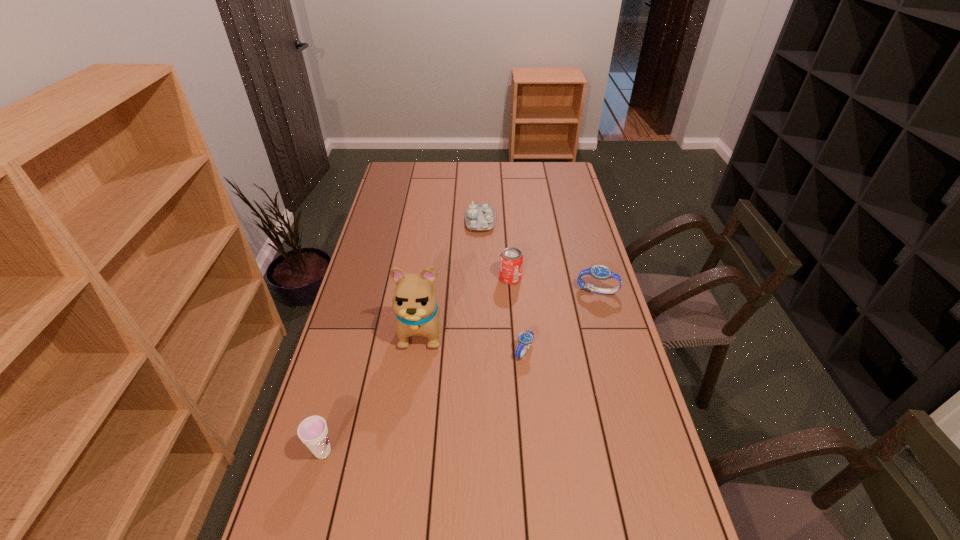
Locate an element on the screen. This screenshot has height=540, width=960. the nearer watch is located at coordinates (525, 339).

Find the location of a particular element. This screenshot has height=540, width=960. the left watch is located at coordinates (525, 339).

The height and width of the screenshot is (540, 960). Identify the location of the right watch. (599, 272).

This screenshot has width=960, height=540. What are the coordinates of `the farther watch` in the screenshot? It's located at (599, 272).

Identify the location of can. (511, 259).

Image resolution: width=960 pixels, height=540 pixels. I want to click on the farthest object, so click(x=480, y=217).

Locate an element on the screen. Image resolution: width=960 pixels, height=540 pixels. the second shortest object is located at coordinates (480, 217).

Where is `the fifth object from right to left`? The height and width of the screenshot is (540, 960). the fifth object from right to left is located at coordinates (415, 304).

I want to click on the tallest object, so click(x=415, y=304).

Where is `the leftmost object`? the leftmost object is located at coordinates (313, 432).